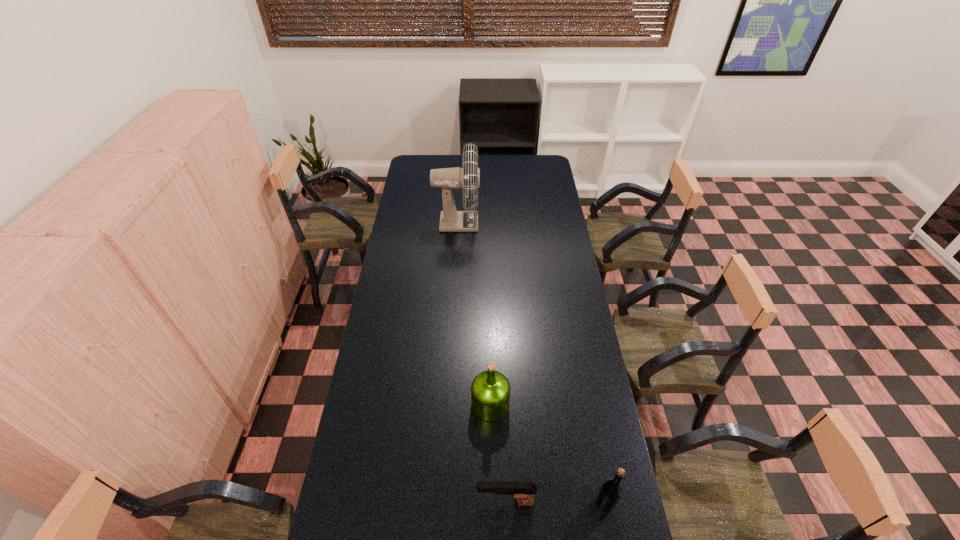
Locate an element on the screen. This screenshot has width=960, height=540. free space that satisfies the following two spatial constraints: 1. at the barrel of the pistol; 2. on the left side of the beer bottle is located at coordinates (505, 503).

This screenshot has width=960, height=540. In order to click on free space that satisfies the following two spatial constraints: 1. on the air flow direction of the tallest object; 2. on the left side of the olive oil in this screenshot , I will do `click(446, 404)`.

Find the location of `free spot that satisfies the following two spatial constraints: 1. on the air flow direction of the rightmost object; 2. on the left side of the tallest object`. free spot that satisfies the following two spatial constraints: 1. on the air flow direction of the rightmost object; 2. on the left side of the tallest object is located at coordinates pyautogui.click(x=441, y=503).

You are a GUI agent. You are given a task and a screenshot of the screen. Output one action in this format:
    pyautogui.click(x=<x>, y=<y>)
    Task: Click on the free space that satisfies the following two spatial constraints: 1. on the air flow direction of the rightmost object; 2. on the left side of the fan
    The image size is (960, 540).
    Given the screenshot: What is the action you would take?
    (x=441, y=503)

Locate an element on the screen. free space in the image that satisfies the following two spatial constraints: 1. on the back side of the rightmost object; 2. at the barrel of the shortest object is located at coordinates (605, 502).

The height and width of the screenshot is (540, 960). Find the location of `vacant area that satisfies the following two spatial constraints: 1. at the barrel of the shortest object; 2. on the left side of the beer bottle`. vacant area that satisfies the following two spatial constraints: 1. at the barrel of the shortest object; 2. on the left side of the beer bottle is located at coordinates (505, 503).

Where is `blank space that satisfies the following two spatial constraints: 1. at the barrel of the rightmost object; 2. on the left side of the pistol`? Image resolution: width=960 pixels, height=540 pixels. blank space that satisfies the following two spatial constraints: 1. at the barrel of the rightmost object; 2. on the left side of the pistol is located at coordinates (505, 503).